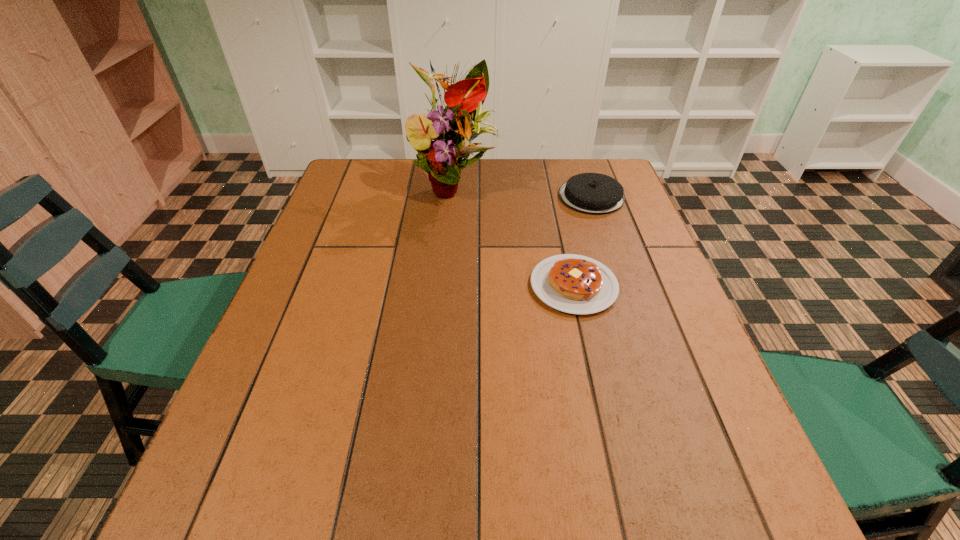
The height and width of the screenshot is (540, 960). Identify the location of bouquet. (458, 124).

Identify the location of the leftmost object. This screenshot has width=960, height=540. (458, 124).

At what (x,y) coordinates should I click in order to perform the action: click on the farther pancake. Please return your answer as a coordinate pair (x, y). This screenshot has height=540, width=960. Looking at the image, I should click on (591, 193).

You are a GUI agent. You are given a task and a screenshot of the screen. Output one action in this format:
    pyautogui.click(x=<x>, y=<y>)
    Task: Click on the taller pancake
    Image resolution: width=960 pixels, height=540 pixels.
    Given the screenshot: What is the action you would take?
    pyautogui.click(x=591, y=193)

Where is `the nearer pancake`? The image size is (960, 540). the nearer pancake is located at coordinates click(x=576, y=284).

Find the location of a particular element. the shortest object is located at coordinates (576, 284).

At what (x,y) coordinates should I click in order to perform the action: click on vacant point located on the front-facing side of the bouquet. Please return your answer as a coordinate pair (x, y). Looking at the image, I should click on (450, 237).

Image resolution: width=960 pixels, height=540 pixels. In order to click on blank area located on the left of the farther pancake in this screenshot , I will do `click(442, 197)`.

You are a GUI agent. You are given a task and a screenshot of the screen. Output one action in this format:
    pyautogui.click(x=<x>, y=<y>)
    Task: Click on the free space located on the front of the nearest object
    This screenshot has width=960, height=540.
    Given the screenshot: What is the action you would take?
    pyautogui.click(x=606, y=428)

Image resolution: width=960 pixels, height=540 pixels. I want to click on bouquet that is at the far edge, so click(x=458, y=124).